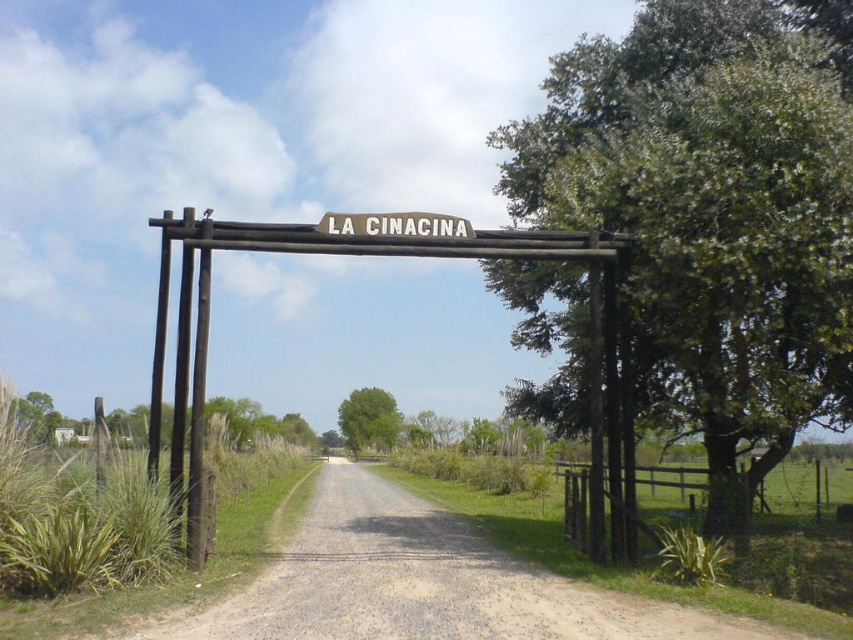
Between point (291, 582) and point (430, 216), which one is positioned in front?

Point (291, 582)

Who is taller, brown gravel dirt track at center or white wooden sign at center?

With more height is brown gravel dirt track at center.

Which is in front, point (532, 616) or point (425, 212)?

Point (532, 616) is in front.

Where is `brown gravel dirt track at center`? Image resolution: width=853 pixels, height=640 pixels. brown gravel dirt track at center is located at coordinates (425, 582).

Which is behind, point (764, 67) or point (460, 234)?

The point (764, 67) is more distant.

Is point (753, 214) positioned in front of point (409, 230)?

Yes, it is.

Is point (824, 227) positioned before point (412, 214)?

Yes, point (824, 227) is in front of point (412, 214).

In order to click on green leafy tree at right in this screenshot , I will do `click(712, 209)`.

Is brown gravel dirt track at center closer to camera compared to green leafy tree at center?

Yes.

Can you confirm if brown gravel dirt track at center is positioned above green leafy tree at center?

Yes.

Is point (367, 570) positioned behind point (352, 396)?

No, (367, 570) is in front of (352, 396).

Image resolution: width=853 pixels, height=640 pixels. What are the coordinates of `brown gravel dirt track at center` in the screenshot? It's located at (425, 582).